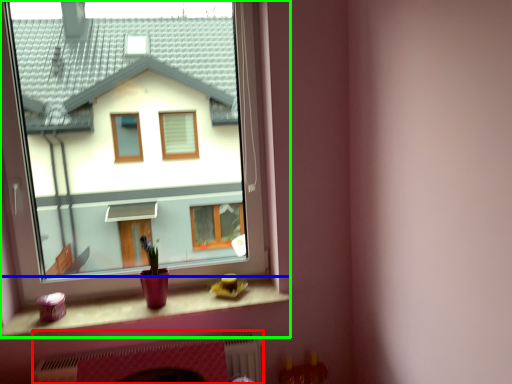
Question: Which is farther away from fireplace (highlighted by a red box)? window sill (highlighted by a blue box) or window (highlighted by a green box)?

Choices:
 (A) window sill
 (B) window

Answer: (B)